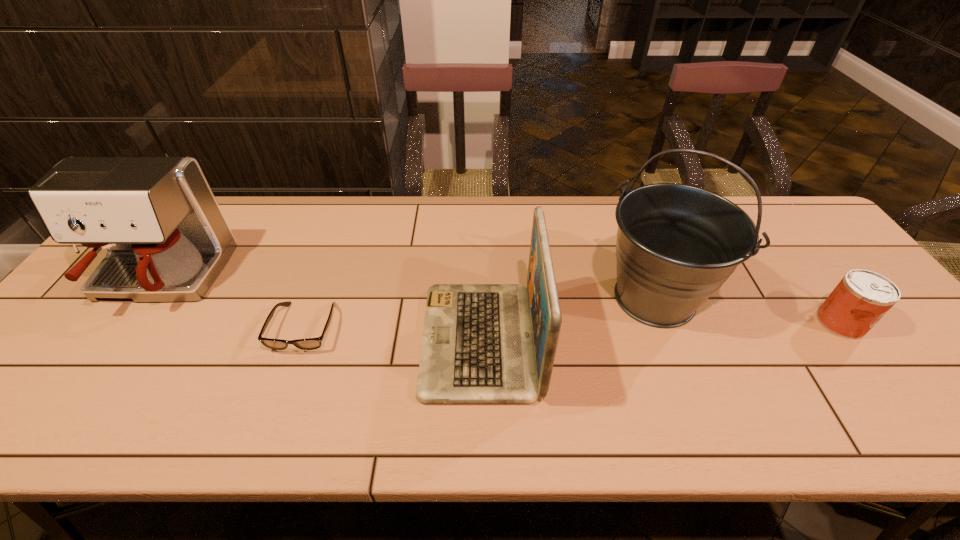
Where is `bucket`? This screenshot has height=540, width=960. bucket is located at coordinates tap(677, 244).

The height and width of the screenshot is (540, 960). Identify the location of the fourth object from left to right. (677, 244).

Where is `coffee maker`? The image size is (960, 540). coffee maker is located at coordinates (167, 239).

At what (x,y) coordinates should I click in order to perform the action: click on laptop computer. Please return your answer as a coordinate pair (x, y). Looking at the image, I should click on (482, 343).

What are the coordinates of `the fourth tallest object` in the screenshot? It's located at (862, 297).

Locate an element on the screen. The width and height of the screenshot is (960, 540). the rightmost object is located at coordinates pos(862,297).

Where is `spectacles`? spectacles is located at coordinates (310, 343).

At what (x,y) coordinates should I click in order to perform the action: click on the shortest object. Please return your answer as a coordinate pair (x, y). The image size is (960, 540). Looking at the image, I should click on (310, 343).

At what (x,y) coordinates should I click in order to perform the action: click on free spot located 0.230m on the back of the tallest object. Please return your answer as a coordinate pair (x, y). Looking at the image, I should click on (621, 210).

You are a GUI agent. You are given a task and a screenshot of the screen. Output one action in this format:
    pyautogui.click(x=<x>, y=<y>)
    Task: Click on the free space located on the front of the coffee maker near the spout
    This screenshot has height=540, width=960.
    Given the screenshot: What is the action you would take?
    pyautogui.click(x=52, y=428)